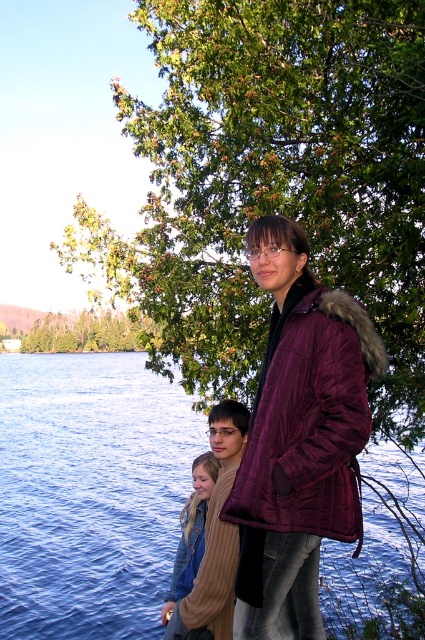
Question: Which point is farther from the camera taking this photo?

Choices:
 (A) (212, 611)
 (B) (288, 360)

Answer: (A)

Question: Is green leafy tree at upper center to the left of maroon quilted jacket at center from the viewer's perspective?

Choices:
 (A) no
 (B) yes

Answer: (B)

Question: Which point appears farthest from the camera in this image?

Choices:
 (A) (377, 464)
 (B) (229, 612)

Answer: (A)

Question: Observing the image, what is the correct spatial positioning of blue water at lower left in reference to light brown knitted sweater at lower center?

Choices:
 (A) below
 (B) above

Answer: (A)

Question: Which point is closer to the camera?

Choices:
 (A) (121, 323)
 (B) (373, 230)
 (C) (302, 449)
 (D) (365, 579)

Answer: (C)

Question: Does brown ribbed sweater at lower center have a lesser width compared to light brown knitted sweater at lower center?

Choices:
 (A) no
 (B) yes

Answer: (A)